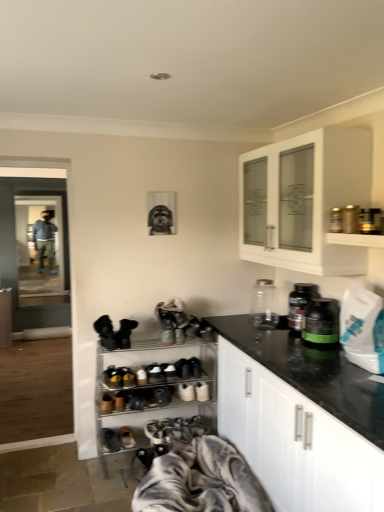
I want to click on vacant area that lies in front of green plastic container at upper right, so click(312, 352).